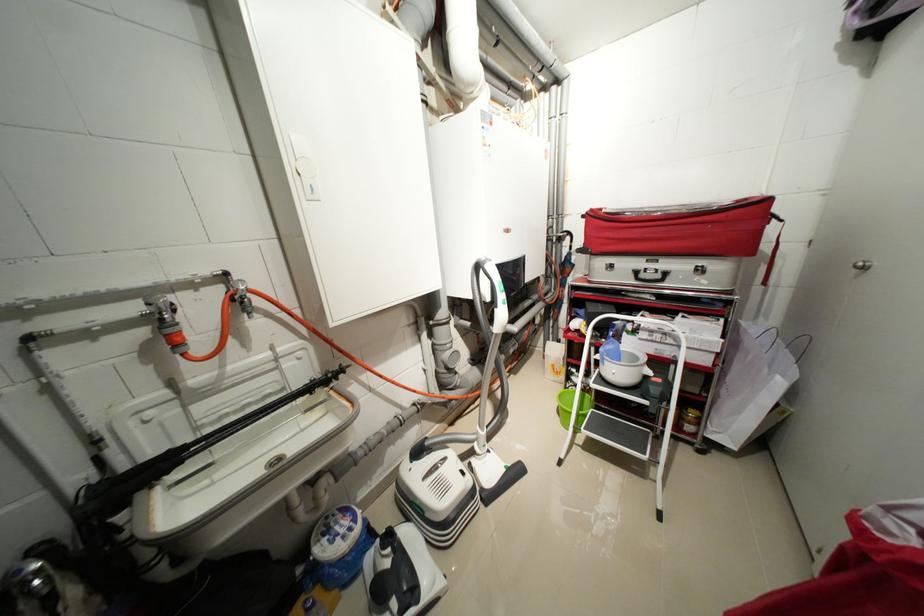
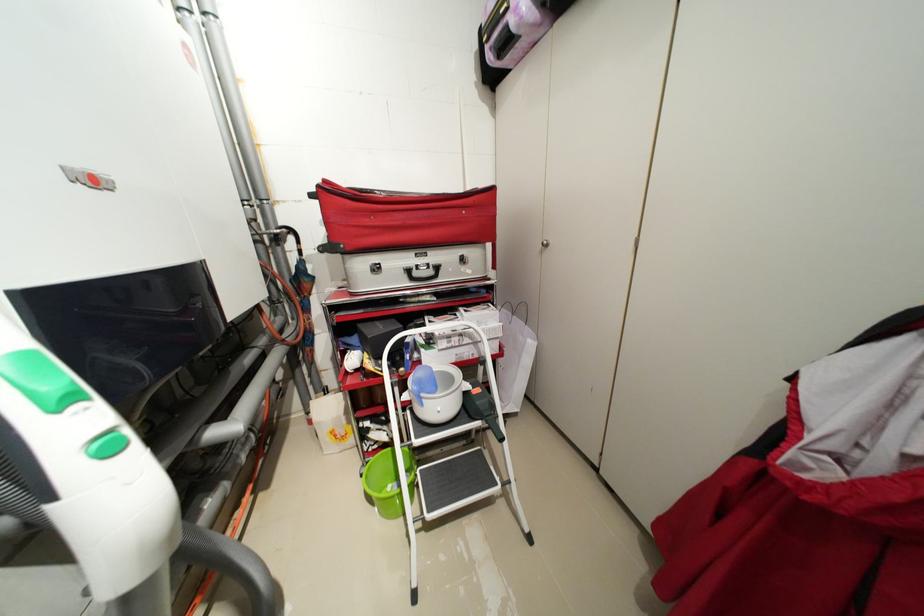
Where in the second image is the point corresponding to (x=665, y=381) from the first image?

(484, 391)